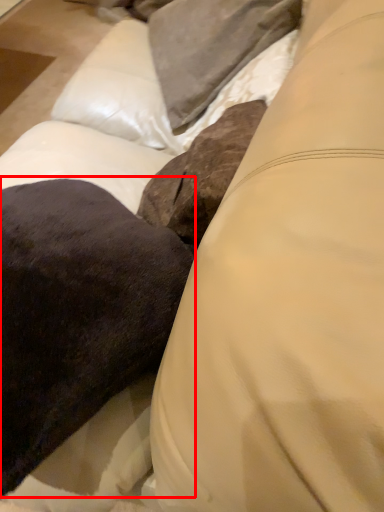
Question: In this image, where is throw pillow (annotated by the red box) located relative to pillow?

Choices:
 (A) left
 (B) right

Answer: (A)